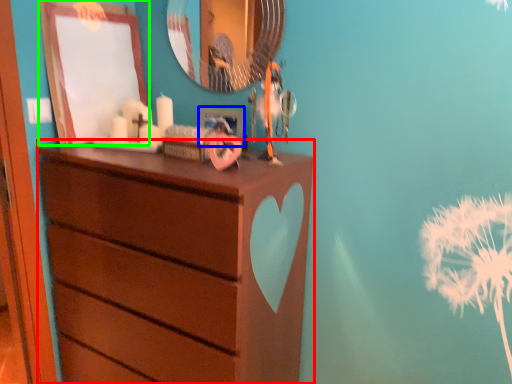
Question: Which is farther away from chest of drawers (highlighted by a red box)? picture frame (highlighted by a blue box) or picture frame (highlighted by a green box)?

Choices:
 (A) picture frame
 (B) picture frame

Answer: (A)